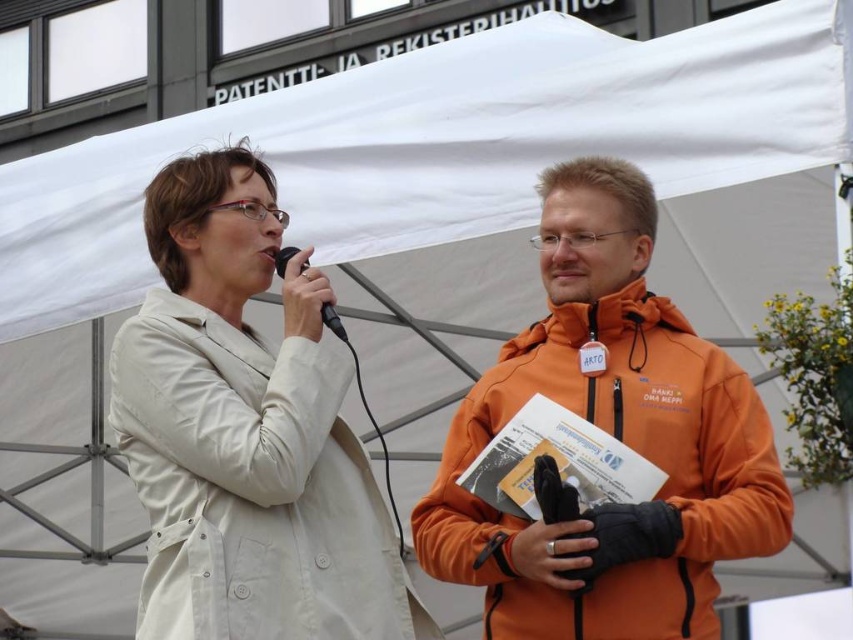
You are organizing an outdoor event and need to determine if a small storage box can fit both the orange fleece jacket at right and the black plastic microphone at center. Based on their sizes, can both items fit into a box that can hold items up to the size of the orange fleece jacket?

The orange fleece jacket at right is larger in size than the black plastic microphone at center. Since the box can hold items up to the size of the orange fleece jacket, both items can fit into the box as the microphone is smaller than the jacket.